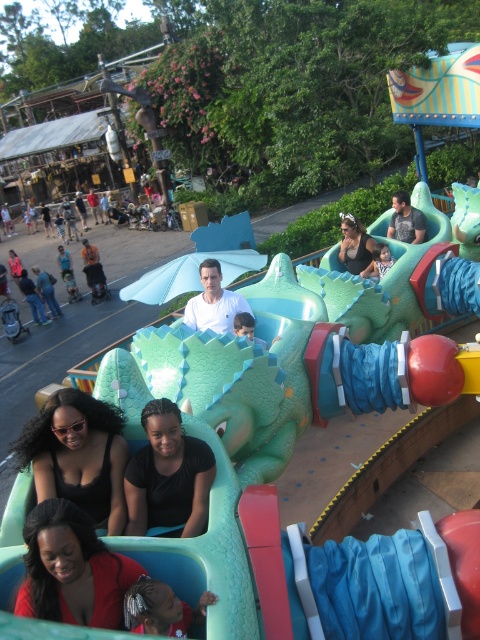
Who is positioned more to the left, matte gray shirt at upper center or jeans at lower left?

jeans at lower left

Is matte gray shirt at upper center smaller than jeans at lower left?

Yes, matte gray shirt at upper center is smaller than jeans at lower left.

Is point (398, 220) positioned in front of point (47, 321)?

Yes, it is.

The image size is (480, 640). Identify the location of matte gray shirt at upper center. (406, 220).

Based on the photo, is the position of black matte hair at lower left more distant than that of matte gray shirt at upper center?

No.

Who is positioned more to the right, black matte hair at lower left or matte gray shirt at upper center?

Positioned to the right is matte gray shirt at upper center.

Which is in front, point (74, 451) or point (394, 236)?

Point (74, 451)

Where is `black matte hair at lower left`? The height and width of the screenshot is (640, 480). black matte hair at lower left is located at coordinates (79, 456).

Does black matte shirt at center appear on the right side of matte black tank top at center?

No, black matte shirt at center is not to the right of matte black tank top at center.

Is point (180, 492) behind point (352, 230)?

No, (180, 492) is closer to viewer.

Find the location of `black matte shirt at center`. black matte shirt at center is located at coordinates (168, 474).

Find the location of a particular element. This screenshot has height=640, width=480. black matte shirt at center is located at coordinates (168, 474).